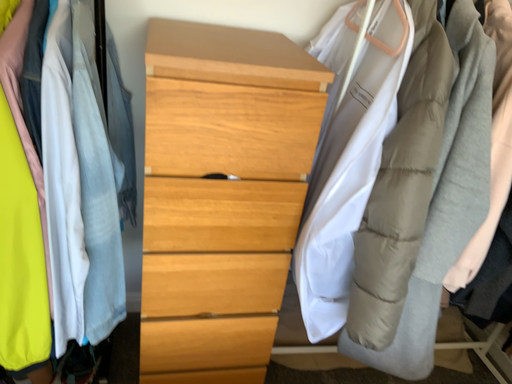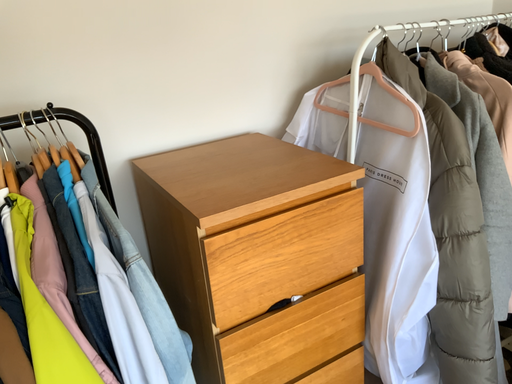
Question: Which way did the camera rotate in the video?

Choices:
 (A) rotated upward
 (B) rotated downward

Answer: (A)